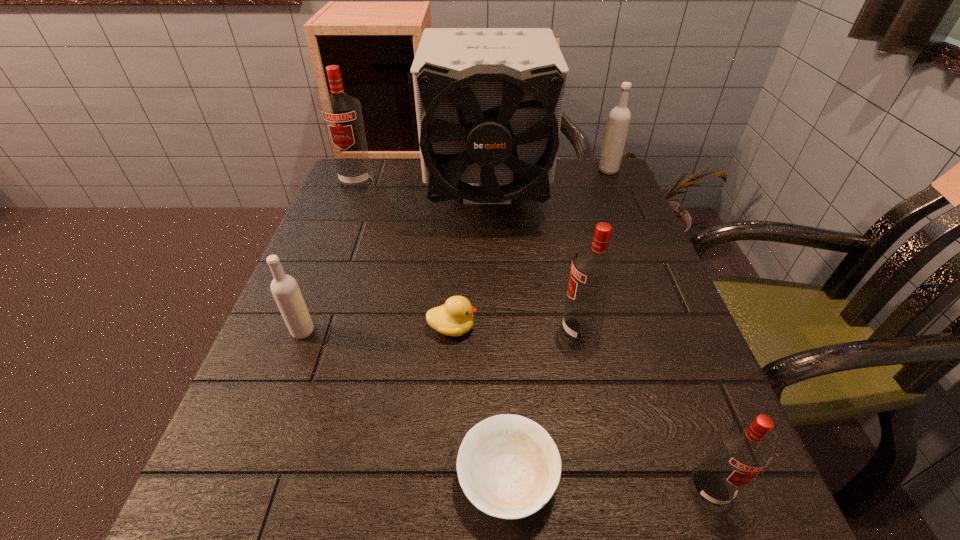
What are the coordinates of `blank space that satisfies the following two spatial constraints: 1. on the beak of the bowl; 2. on the right side of the seventh tallest object` in the screenshot? It's located at (444, 480).

Identify the location of blank space that satisfies the following two spatial constraints: 1. on the front label of the second biggest red vodka; 2. on the front side of the shortest object. (612, 480).

The height and width of the screenshot is (540, 960). I want to click on vacant area that satisfies the following two spatial constraints: 1. on the beak of the beige bowl; 2. on the left side of the duckling, so click(x=444, y=480).

Locate an element on the screen. vacant region that satisfies the following two spatial constraints: 1. on the back side of the left white vodka; 2. on the left side of the fan is located at coordinates (353, 197).